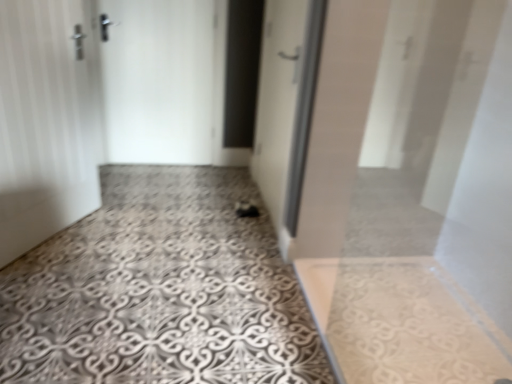
Question: Does patterned concrete floor at center turn towards white matte door at left, acting as the 1th door starting from the left?

Choices:
 (A) yes
 (B) no

Answer: (B)

Question: Is patterned concrete floor at center positioned in front of white matte door at left, acting as the 1th door starting from the left?

Choices:
 (A) no
 (B) yes

Answer: (B)

Question: Considering the relative positions of patterned concrete floor at center and white matte door at left, the 3th door when ordered from right to left, in the image provided, is patterned concrete floor at center behind white matte door at left, the 3th door when ordered from right to left,?

Choices:
 (A) yes
 (B) no

Answer: (B)

Question: Is the surface of patterned concrete floor at center in direct contact with white matte door at left, acting as the 1th door starting from the left?

Choices:
 (A) no
 (B) yes

Answer: (A)

Question: From the image's perspective, would you say patterned concrete floor at center is positioned over white matte door at left, the 3th door when ordered from right to left?

Choices:
 (A) yes
 (B) no

Answer: (B)

Question: From a real-world perspective, is white matte door at left, acting as the 1th door starting from the left, physically located above or below white glossy door at center, the first door in the right-to-left sequence?

Choices:
 (A) below
 (B) above

Answer: (A)

Question: Considering the positions of white matte door at left, the 3th door when ordered from right to left, and white glossy door at center, the first door in the right-to-left sequence, in the image, is white matte door at left, the 3th door when ordered from right to left, wider or thinner than white glossy door at center, the first door in the right-to-left sequence,?

Choices:
 (A) thin
 (B) wide

Answer: (A)

Question: Looking at the image, does white matte door at left, acting as the 1th door starting from the left, seem bigger or smaller compared to white glossy door at center, which is the 3th door from left to right?

Choices:
 (A) big
 (B) small

Answer: (B)

Question: Is white matte door at left, the 3th door when ordered from right to left, inside or outside of white glossy door at center, the first door in the right-to-left sequence?

Choices:
 (A) inside
 (B) outside

Answer: (B)

Question: In the image, is white matte door at center, the second door in the left-to-right sequence, on the left side or the right side of white matte door at left, acting as the 1th door starting from the left?

Choices:
 (A) left
 (B) right

Answer: (B)

Question: In terms of width, does white matte door at center, the 2th door in the right-to-left sequence, look wider or thinner when compared to white matte door at left, the 3th door when ordered from right to left?

Choices:
 (A) thin
 (B) wide

Answer: (A)

Question: From a real-world perspective, is white matte door at center, the second door in the left-to-right sequence, physically located above or below white matte door at left, the 3th door when ordered from right to left?

Choices:
 (A) above
 (B) below

Answer: (A)

Question: Based on their sizes in the image, would you say white matte door at center, the second door in the left-to-right sequence, is bigger or smaller than white matte door at left, acting as the 1th door starting from the left?

Choices:
 (A) big
 (B) small

Answer: (B)

Question: In terms of width, does white matte door at center, the 2th door in the right-to-left sequence, look wider or thinner when compared to white glossy door at center, which is the 3th door from left to right?

Choices:
 (A) wide
 (B) thin

Answer: (B)

Question: From a real-world perspective, is white matte door at center, the 2th door in the right-to-left sequence, physically located above or below white glossy door at center, which is the 3th door from left to right?

Choices:
 (A) below
 (B) above

Answer: (A)